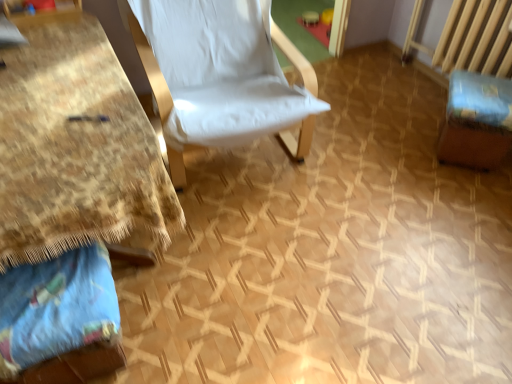
Question: Should I look upward or downward to see brown fabric swivel chair at right?

Choices:
 (A) down
 (B) up

Answer: (B)

Question: Can you confirm if brown fabric swivel chair at right is thinner than wooden table at left?

Choices:
 (A) no
 (B) yes

Answer: (B)

Question: From the image's perspective, is brown fabric swivel chair at right under wooden table at left?

Choices:
 (A) yes
 (B) no

Answer: (B)

Question: Can you confirm if brown fabric swivel chair at right is bigger than wooden table at left?

Choices:
 (A) no
 (B) yes

Answer: (A)

Question: Is wooden table at left at the back of brown fabric swivel chair at right?

Choices:
 (A) no
 (B) yes

Answer: (A)

Question: Does brown fabric swivel chair at right appear on the right side of wooden table at left?

Choices:
 (A) yes
 (B) no

Answer: (A)

Question: Is brown fabric swivel chair at right oriented towards wooden table at left?

Choices:
 (A) no
 (B) yes

Answer: (A)

Question: Does blue cotton pillow at lower left have a smaller size compared to wooden table at left?

Choices:
 (A) yes
 (B) no

Answer: (A)

Question: Is blue cotton pillow at lower left completely or partially outside of wooden table at left?

Choices:
 (A) no
 (B) yes

Answer: (A)

Question: Are blue cotton pillow at lower left and wooden table at left making contact?

Choices:
 (A) yes
 (B) no

Answer: (B)

Question: Is blue cotton pillow at lower left to the left of wooden table at left from the viewer's perspective?

Choices:
 (A) no
 (B) yes

Answer: (A)

Question: Is blue cotton pillow at lower left positioned before wooden table at left?

Choices:
 (A) no
 (B) yes

Answer: (A)

Question: From the image's perspective, is blue cotton pillow at lower left over wooden table at left?

Choices:
 (A) yes
 (B) no

Answer: (B)

Question: Are blue cotton pillow at lower left and brown fabric swivel chair at right far apart?

Choices:
 (A) no
 (B) yes

Answer: (B)